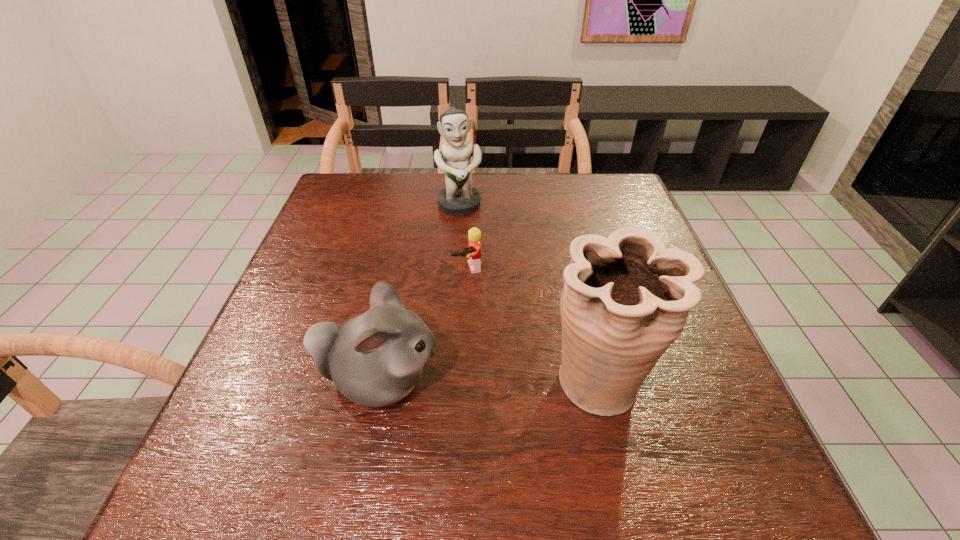
You are a GUI agent. You are given a task and a screenshot of the screen. Output one action in this format:
    pyautogui.click(x=<x>, y=<y>)
    Task: Click on the vacant space on the desktop that is between the hamster and the rightmost object and is positioned on the front-facing side of the figurine
    Image resolution: width=960 pixels, height=540 pixels.
    Given the screenshot: What is the action you would take?
    pyautogui.click(x=504, y=381)

Where is `free spot on the desktop that is between the third tallest object and the rightmost object and is positioned in front of the third nearest object with the accessory visible`? This screenshot has width=960, height=540. free spot on the desktop that is between the third tallest object and the rightmost object and is positioned in front of the third nearest object with the accessory visible is located at coordinates (507, 381).